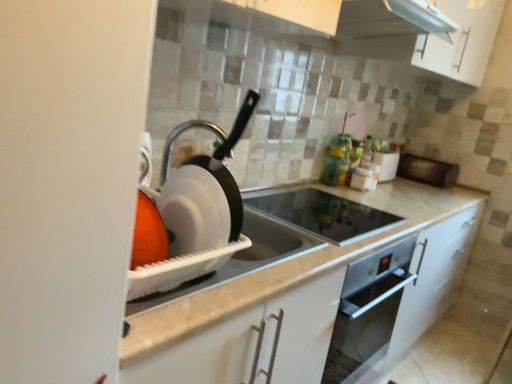
Question: From their relative heights in the image, would you say black glass cooktop at center, the second appliance from the front, is taller or shorter than white marble countertop at center?

Choices:
 (A) short
 (B) tall

Answer: (A)

Question: Considering the positions of black glass cooktop at center, the second appliance from the front, and white marble countertop at center in the image, is black glass cooktop at center, the second appliance from the front, bigger or smaller than white marble countertop at center?

Choices:
 (A) big
 (B) small

Answer: (B)

Question: Estimate the real-world distances between objects in this image. Which object is closer to the white plastic dish rack at left, which is the 1th appliance in front-to-back order?

Choices:
 (A) black matte microwave at right, positioned as the 1th appliance in right-to-left order
 (B) black glass cooktop at center, the second appliance when ordered from left to right
 (C) white marble countertop at center
 (D) white glossy toaster at upper right, the second appliance when ordered from right to left
 (E) white glossy exhaust hood at upper center

Answer: (C)

Question: Which of these objects is positioned closest to the black glass cooktop at center, the second appliance from the front?

Choices:
 (A) black matte microwave at right, the 1th appliance from the back
 (B) white marble countertop at center
 (C) white glossy exhaust hood at upper center
 (D) white glossy toaster at upper right, which ranks as the 3th appliance in front-to-back order
 (E) white plastic dish rack at left, the fourth appliance when ordered from back to front

Answer: (B)